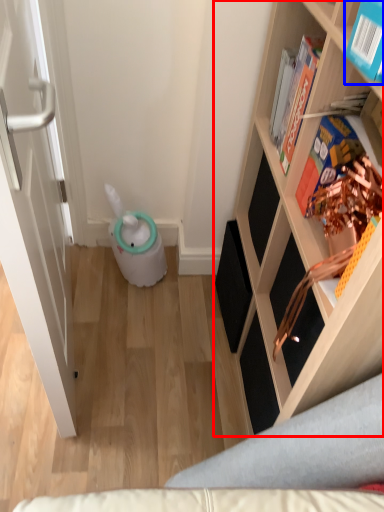
Question: Which of the following is the closest to the observer, shelf (highlighted by a red box) or book (highlighted by a blue box)?

Choices:
 (A) shelf
 (B) book

Answer: (A)